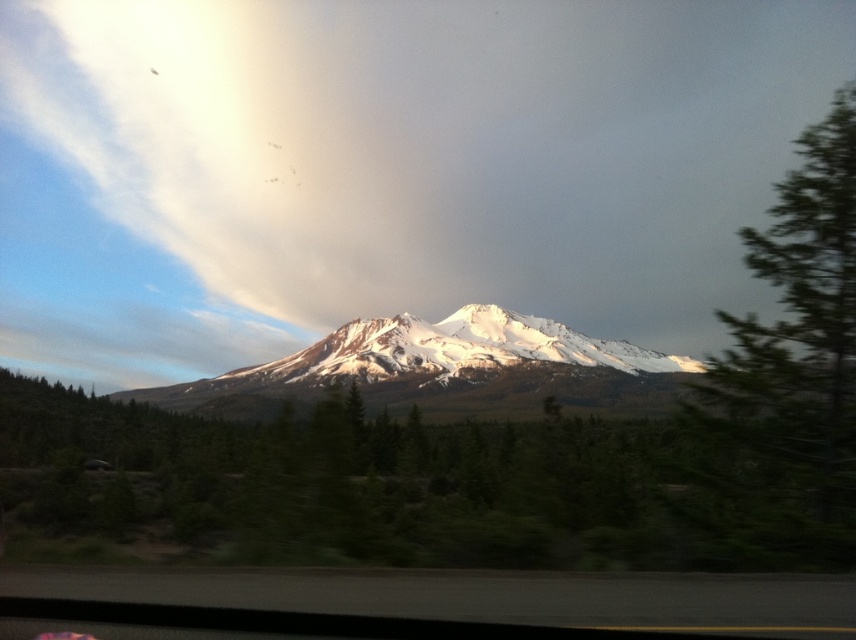
Image resolution: width=856 pixels, height=640 pixels. In order to click on green textured tree at right in this screenshot , I will do `click(786, 372)`.

Does green textured tree at right appear under black asphalt highway at lower center?

Actually, green textured tree at right is above black asphalt highway at lower center.

At what (x,y) coordinates should I click in order to perform the action: click on green textured tree at right. Please return your answer as a coordinate pair (x, y). This screenshot has width=856, height=640. Looking at the image, I should click on (786, 372).

Is point (586, 612) closer to viewer compared to point (379, 321)?

That is True.

Who is positioned more to the left, black asphalt highway at lower center or snowy white mountain at center?

From the viewer's perspective, black asphalt highway at lower center appears more on the left side.

What do you see at coordinates (479, 595) in the screenshot? This screenshot has width=856, height=640. I see `black asphalt highway at lower center` at bounding box center [479, 595].

In order to click on black asphalt highway at lower center in this screenshot , I will do `click(479, 595)`.

Can you confirm if green textured tree at right is smaller than snowy white mountain at center?

Actually, green textured tree at right might be larger than snowy white mountain at center.

Is green textured tree at right bigger than snowy white mountain at center?

Correct, green textured tree at right is larger in size than snowy white mountain at center.

The width and height of the screenshot is (856, 640). What do you see at coordinates (786, 372) in the screenshot?
I see `green textured tree at right` at bounding box center [786, 372].

Locate an element on the screen. The image size is (856, 640). green textured tree at right is located at coordinates pyautogui.click(x=786, y=372).